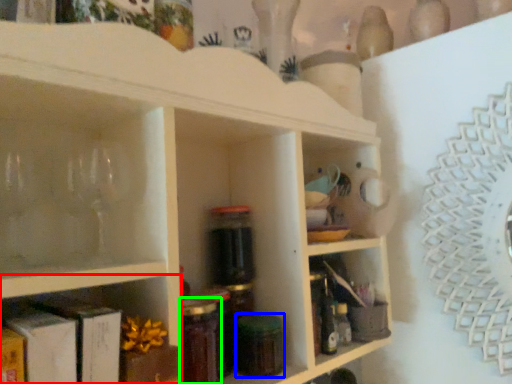
Question: Which object is the farthest from shelf (highlighted by a red box)? Choose among these: glass jar (highlighted by a blue box) or bottle (highlighted by a green box).

Choices:
 (A) glass jar
 (B) bottle

Answer: (A)